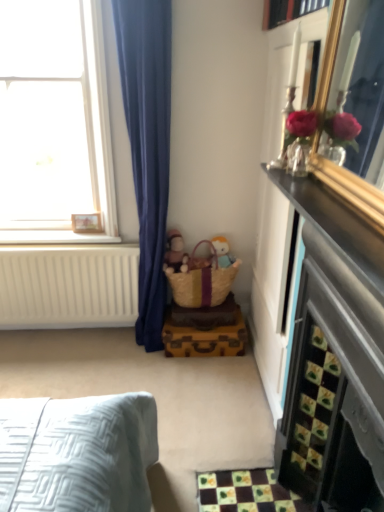
Locate an element on the screen. Image resolution: width=384 pixels, height=512 pixels. matte brown doll at center is located at coordinates (174, 250).

The image size is (384, 512). I want to click on wooden picture frame at upper left, so click(87, 223).

Where is `white painted wood at left`? This screenshot has height=512, width=384. white painted wood at left is located at coordinates (54, 237).

Identify the location of yellow woven basket at center. (202, 280).

Where is `soft plush toy at center`? This screenshot has width=384, height=512. soft plush toy at center is located at coordinates (223, 251).

Are soft plush toy at center and white painted wood at left located far from each other?

No.

Which point is more distant from viewer, [220,239] or [23,242]?

The point [220,239] is farther from the camera.

From a real-world perspective, is soft plush toy at center physically located above or below white painted wood at left?

soft plush toy at center is below white painted wood at left.

Considering the positions of objects soft plush toy at center and white painted wood at left in the image provided, who is more to the left, soft plush toy at center or white painted wood at left?

From the viewer's perspective, white painted wood at left appears more on the left side.

Who is smaller, matte brown doll at center or wooden picture frame at upper left?

wooden picture frame at upper left is smaller.

Is matte brown doll at center positioned far away from wooden picture frame at upper left?

matte brown doll at center is actually quite close to wooden picture frame at upper left.

Is point (179, 253) closer to viewer compared to point (97, 231)?

No, it is not.

Is clear glass window at upper left in contact with yellow woven basket at center?

They are not placed beside each other.

Considering the positions of objects clear glass window at upper left and yellow woven basket at center in the image provided, who is in front, clear glass window at upper left or yellow woven basket at center?

clear glass window at upper left is more forward.

The image size is (384, 512). Find the location of `window on the left side of yellow woven basket at center`. window on the left side of yellow woven basket at center is located at coordinates (54, 121).

Who is bigger, clear glass window at upper left or yellow woven basket at center?

With larger size is clear glass window at upper left.

Is soft plush toy at center in front of or behind clear glass window at upper left in the image?

In the image, soft plush toy at center appears behind clear glass window at upper left.

From the image's perspective, which object appears higher, soft plush toy at center or clear glass window at upper left?

From the image's view, clear glass window at upper left is above.

Considering the relative sizes of soft plush toy at center and clear glass window at upper left in the image provided, is soft plush toy at center bigger than clear glass window at upper left?

Actually, soft plush toy at center might be smaller than clear glass window at upper left.

From a real-world perspective, does soft plush toy at center stand above clear glass window at upper left?

No, from a real-world perspective, soft plush toy at center is not on top of clear glass window at upper left.

Is white painted wood at left at the left side of matte brown doll at center?

Yes, white painted wood at left is to the left of matte brown doll at center.

Is white painted wood at left positioned with its back to matte brown doll at center?

white painted wood at left is not turned away from matte brown doll at center.

In the scene shown: Considering the positions of objects white painted wood at left and matte brown doll at center in the image provided, who is behind, white painted wood at left or matte brown doll at center?

white painted wood at left is further from the camera.

Is point (206, 303) positioned before point (232, 257)?

Yes, it is.

Between yellow woven basket at center and soft plush toy at center, which one is positioned in front?

Positioned in front is yellow woven basket at center.

From a real-world perspective, which is physically above, yellow woven basket at center or soft plush toy at center?

From a 3D spatial view, soft plush toy at center is above.

Which of these two, yellow woven basket at center or soft plush toy at center, stands shorter?

Standing shorter between the two is soft plush toy at center.

Is yellow woven basket at center in front of clear glass window at upper left?

No, yellow woven basket at center is further to the viewer.

Does yellow woven basket at center have a larger size compared to clear glass window at upper left?

Incorrect, yellow woven basket at center is not larger than clear glass window at upper left.

Consider the image. From the image's perspective, does yellow woven basket at center appear higher than clear glass window at upper left?

Actually, yellow woven basket at center appears below clear glass window at upper left in the image.

Is yellow woven basket at center positioned with its back to clear glass window at upper left?

yellow woven basket at center is not turned away from clear glass window at upper left.

This screenshot has width=384, height=512. What are the coordinates of `toy on the right of white painted wood at left` in the screenshot? It's located at (223, 251).

Identify the location of doll directly beneath the wooden picture frame at upper left (from a real-world perspective). The width and height of the screenshot is (384, 512). 174,250.

From the image, which object appears to be farther from wooden picture frame at upper left, soft plush toy at center or matte brown doll at center?

soft plush toy at center is positioned further to the anchor wooden picture frame at upper left.

Looking at the image, which one is located closer to clear glass window at upper left, soft plush toy at center or yellow woven basket at center?

yellow woven basket at center.

Which object lies nearer to the anchor point wooden picture frame at upper left, clear glass window at upper left or matte brown doll at center?

Based on the image, matte brown doll at center appears to be nearer to wooden picture frame at upper left.

Which object lies nearer to the anchor point soft plush toy at center, wooden picture frame at upper left or white painted wood at left?

Among the two, wooden picture frame at upper left is located nearer to soft plush toy at center.

Which object lies further to the anchor point wooden picture frame at upper left, yellow woven basket at center or clear glass window at upper left?

Among the two, yellow woven basket at center is located further to wooden picture frame at upper left.

Considering their positions, is yellow woven basket at center positioned closer to clear glass window at upper left than matte brown doll at center?

Among the two, yellow woven basket at center is located nearer to clear glass window at upper left.

Estimate the real-world distances between objects in this image. Which object is further from yellow woven basket at center, wooden picture frame at upper left or white painted wood at left?

wooden picture frame at upper left is positioned further to the anchor yellow woven basket at center.

Considering their positions, is clear glass window at upper left positioned closer to white painted wood at left than matte brown doll at center?

The object closer to white painted wood at left is clear glass window at upper left.

This screenshot has width=384, height=512. What are the coordinates of `window sill situated between clear glass window at upper left and yellow woven basket at center from left to right` in the screenshot? It's located at (54, 237).

The image size is (384, 512). In order to click on basket between clear glass window at upper left and soft plush toy at center in the horizontal direction in this screenshot , I will do `click(202, 280)`.

What are the coordinates of `picture frame situated between clear glass window at upper left and matte brown doll at center from left to right` in the screenshot? It's located at (87, 223).

Locate an element on the screen. This screenshot has width=384, height=512. basket situated between white painted wood at left and soft plush toy at center from left to right is located at coordinates (202, 280).